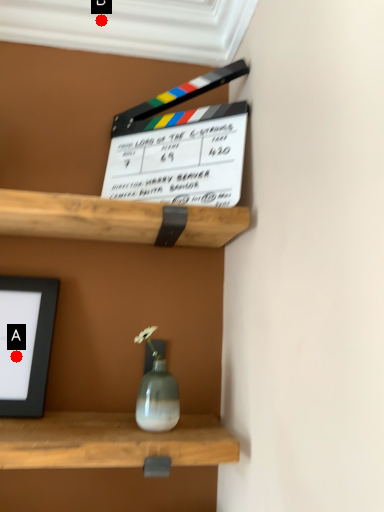
Question: Two points are circled on the image, labeled by A and B beside each circle. Which point is closer to the camera taking this photo?

Choices:
 (A) A is closer
 (B) B is closer

Answer: (A)